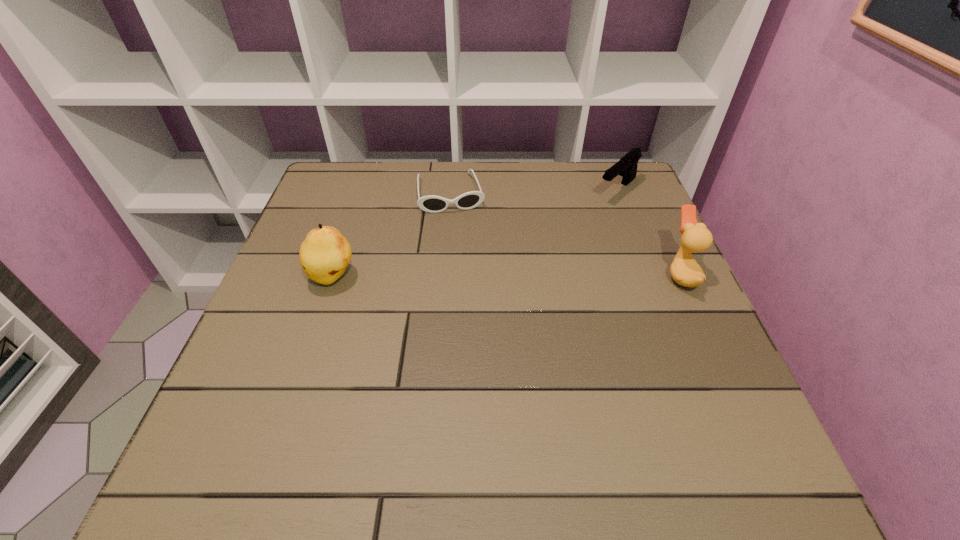
At what (x,y) coordinates should I click in order to perform the action: click on free spot between the leftmost object and the pistol. Please return your answer as a coordinate pair (x, y). The height and width of the screenshot is (540, 960). Looking at the image, I should click on (475, 234).

Locate an element on the screen. The height and width of the screenshot is (540, 960). vacant area between the pear and the duck is located at coordinates (507, 276).

Find the location of a particular element. Image resolution: width=960 pixels, height=540 pixels. vacant space in between the shortest object and the duck is located at coordinates (565, 234).

I want to click on unoccupied position between the leftmost object and the pistol, so click(475, 234).

The width and height of the screenshot is (960, 540). I want to click on vacant space in between the shortest object and the duck, so click(x=565, y=234).

Find the location of `free space between the duck and the second object from left to right`. free space between the duck and the second object from left to right is located at coordinates (565, 234).

Where is `vacant space that is in between the duck and the pear`? The width and height of the screenshot is (960, 540). vacant space that is in between the duck and the pear is located at coordinates (507, 276).

You are a GUI agent. You are given a task and a screenshot of the screen. Output one action in this format:
    pyautogui.click(x=<x>, y=<y>)
    Task: Click on the unoccupied position between the third tallest object and the second object from left to right
    Image resolution: width=960 pixels, height=540 pixels.
    Given the screenshot: What is the action you would take?
    pyautogui.click(x=535, y=192)

Where is `the third closest object to the leftmost object`? the third closest object to the leftmost object is located at coordinates (684, 270).

At what (x,y) coordinates should I click in order to perform the action: click on object that ranks as the third closest to the duck. Please return your answer as a coordinate pair (x, y). Looking at the image, I should click on (325, 253).